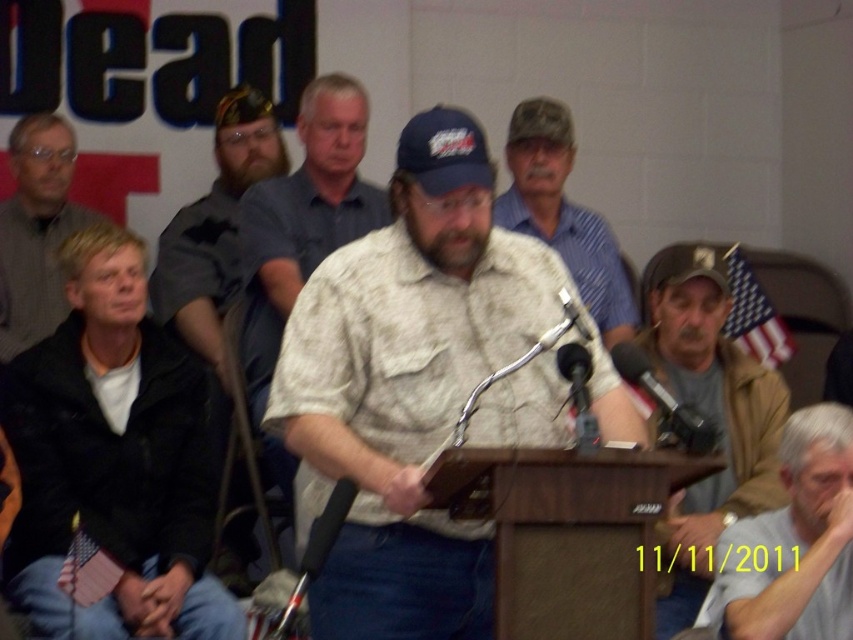
Question: Estimate the real-world distances between objects in this image. Which object is farther from the black leather jacket at lower left?

Choices:
 (A) camo fabric shirt at center
 (B) brown leather jacket at lower right

Answer: (B)

Question: Is black metallic microphone at right to the left of metallic silver microphone at center from the viewer's perspective?

Choices:
 (A) no
 (B) yes

Answer: (A)

Question: Can you confirm if camo fabric shirt at center is positioned above metallic silver microphone at center?

Choices:
 (A) yes
 (B) no

Answer: (A)

Question: Estimate the real-world distances between objects in this image. Which object is closer to the camo fabric shirt at center?

Choices:
 (A) brown leather jacket at lower right
 (B) black leather jacket at lower left

Answer: (A)

Question: Is gray knit sweater at left closer to the viewer compared to black metallic microphone at right?

Choices:
 (A) yes
 (B) no

Answer: (B)

Question: Which of the following is the closest to the observer?

Choices:
 (A) gray fabric shirt at lower right
 (B) black metallic microphone at right
 (C) brown leather jacket at lower right
 (D) gray knit sweater at left

Answer: (B)